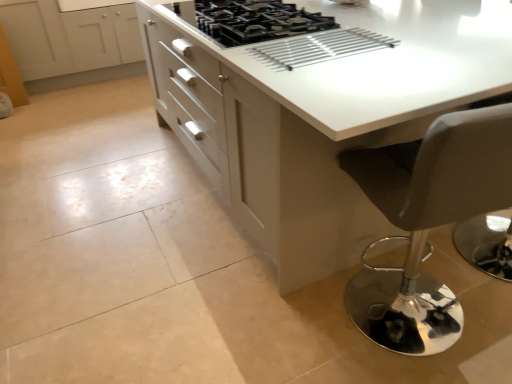
The height and width of the screenshot is (384, 512). Find the location of `white glossy countertop at center`. white glossy countertop at center is located at coordinates (319, 111).

What do you see at coordinates (426, 224) in the screenshot?
I see `matte black stool at lower right` at bounding box center [426, 224].

Where is `white glossy cabinet at upper left`? Image resolution: width=512 pixels, height=384 pixels. white glossy cabinet at upper left is located at coordinates (69, 37).

This screenshot has width=512, height=384. Find the location of `white glossy countertop at center`. white glossy countertop at center is located at coordinates (319, 111).

Considering the positions of objects white glossy countertop at center and matte black stool at lower right in the image provided, who is behind, white glossy countertop at center or matte black stool at lower right?

white glossy countertop at center is behind.

Is matte black stool at lower right inside white glossy countertop at center?

Yes.

From the image's perspective, would you say white glossy countertop at center is shown under matte black stool at lower right?

Incorrect, from the image's perspective, white glossy countertop at center is higher than matte black stool at lower right.

Is white glossy cabinet at upper left wider than black matte gas stove at center?

Yes.

Is point (91, 41) less distant than point (280, 11)?

That is False.

Is white glossy cabinet at upper left to the left of black matte gas stove at center from the viewer's perspective?

Correct, you'll find white glossy cabinet at upper left to the left of black matte gas stove at center.

Is white glossy cabinet at upper left inside the boundaries of black matte gas stove at center, or outside?

white glossy cabinet at upper left exists outside the volume of black matte gas stove at center.

Considering the sizes of black matte gas stove at center and white glossy cabinet at upper left in the image, is black matte gas stove at center wider or thinner than white glossy cabinet at upper left?

Clearly, black matte gas stove at center has less width compared to white glossy cabinet at upper left.

Can you see black matte gas stove at center touching white glossy cabinet at upper left?

No, black matte gas stove at center is not with white glossy cabinet at upper left.

From a real-world perspective, which is physically above, black matte gas stove at center or white glossy cabinet at upper left?

black matte gas stove at center is physically above.

Which object is more forward, black matte gas stove at center or white glossy cabinet at upper left?

black matte gas stove at center is more forward.

The width and height of the screenshot is (512, 384). Identify the location of gas stove above the white glossy countertop at center (from a real-world perspective). (250, 20).

Can you confirm if white glossy countertop at center is positioned to the left of black matte gas stove at center?

Incorrect, white glossy countertop at center is not on the left side of black matte gas stove at center.

From the image's perspective, which is above, white glossy countertop at center or black matte gas stove at center?

black matte gas stove at center appears higher in the image.

From the picture: Could you tell me if matte black stool at lower right is turned towards white glossy cabinet at upper left?

Yes, matte black stool at lower right is facing white glossy cabinet at upper left.

The width and height of the screenshot is (512, 384). Find the location of `cabinetry that is above the matte black stool at lower right (from the image's perspective)`. cabinetry that is above the matte black stool at lower right (from the image's perspective) is located at coordinates (69, 37).

Can you tell me how much matte black stool at lower right and white glossy cabinet at upper left differ in facing direction?

The facing directions of matte black stool at lower right and white glossy cabinet at upper left are 170 degrees apart.

From the image's perspective, would you say matte black stool at lower right is positioned over white glossy cabinet at upper left?

No.

Locate an element on the screen. Image resolution: width=512 pixels, height=384 pixels. chair below the black matte gas stove at center (from the image's perspective) is located at coordinates point(426,224).

From the image's perspective, which one is positioned lower, matte black stool at lower right or black matte gas stove at center?

matte black stool at lower right.

Is black matte gas stove at center at the back of matte black stool at lower right?

No.

Is point (397, 171) closer to camera compared to point (253, 40)?

Yes, point (397, 171) is closer to viewer.

Is white glossy cabinet at upper left looking in the opposite direction of white glossy countertop at center?

white glossy cabinet at upper left is not turned away from white glossy countertop at center.

Between point (140, 50) and point (272, 251), which one is positioned in front?

The point (272, 251) is in front.

From the image's perspective, which is above, white glossy cabinet at upper left or white glossy countertop at center?

From the image's view, white glossy cabinet at upper left is above.

Can we say white glossy cabinet at upper left lies outside white glossy countertop at center?

That's correct, white glossy cabinet at upper left is outside of white glossy countertop at center.

The image size is (512, 384). I want to click on chair on the right of white glossy countertop at center, so click(x=426, y=224).

Locate an element on the screen. This screenshot has height=384, width=512. cabinetry above the black matte gas stove at center (from the image's perspective) is located at coordinates point(69,37).

Looking at the image, which one is located closer to matte black stool at lower right, white glossy countertop at center or black matte gas stove at center?

white glossy countertop at center.

Consider the image. Considering their positions, is matte black stool at lower right positioned further to white glossy countertop at center than white glossy cabinet at upper left?

Among the two, white glossy cabinet at upper left is located further to white glossy countertop at center.

Which object lies further to the anchor point white glossy cabinet at upper left, black matte gas stove at center or matte black stool at lower right?

The object further to white glossy cabinet at upper left is matte black stool at lower right.

Looking at the image, which one is located further to black matte gas stove at center, matte black stool at lower right or white glossy cabinet at upper left?

white glossy cabinet at upper left is further to black matte gas stove at center.

From the picture: Which object lies further to the anchor point black matte gas stove at center, white glossy countertop at center or matte black stool at lower right?

Based on the image, matte black stool at lower right appears to be further to black matte gas stove at center.

Based on their spatial positions, is matte black stool at lower right or white glossy countertop at center closer to white glossy cabinet at upper left?

white glossy countertop at center is closer to white glossy cabinet at upper left.

Which object lies nearer to the anchor point white glossy countertop at center, black matte gas stove at center or white glossy cabinet at upper left?

black matte gas stove at center is positioned closer to the anchor white glossy countertop at center.

Considering their positions, is white glossy cabinet at upper left positioned further to white glossy countertop at center than black matte gas stove at center?

white glossy cabinet at upper left lies further to white glossy countertop at center than the other object.

You are a GUI agent. You are given a task and a screenshot of the screen. Output one action in this format:
    pyautogui.click(x=<x>, y=<y>)
    Task: Click on the countertop between black matte gas stove at center and matte black stool at lower right in the vertical direction
    
    Given the screenshot: What is the action you would take?
    pyautogui.click(x=319, y=111)

The image size is (512, 384). What are the coordinates of `gas stove between matte black stool at lower right and white glossy cabinet at upper left along the z-axis` in the screenshot? It's located at (250, 20).

Where is `countertop positioned between matte black stool at lower right and white glossy cabinet at upper left from near to far`? The width and height of the screenshot is (512, 384). countertop positioned between matte black stool at lower right and white glossy cabinet at upper left from near to far is located at coordinates (319, 111).

Locate an element on the screen. gas stove between white glossy countertop at center and white glossy cabinet at upper left along the z-axis is located at coordinates (250, 20).